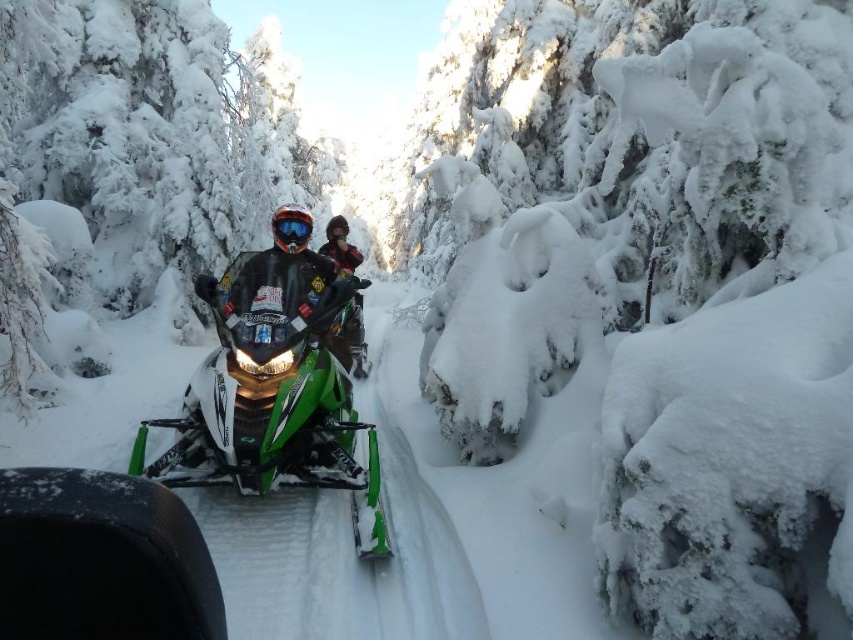
Based on the photo, does white frosty tree at center appear on the left side of green matte/snowmobile at center?

Yes, white frosty tree at center is to the left of green matte/snowmobile at center.

Which is below, white frosty tree at center or green matte/snowmobile at center?

green matte/snowmobile at center is below.

Identify the location of white frosty tree at center. (132, 150).

Is shiny black jacket at center to the left of red plaid jacket at center from the viewer's perspective?

In fact, shiny black jacket at center is to the right of red plaid jacket at center.

Can you confirm if shiny black jacket at center is wider than red plaid jacket at center?

In fact, shiny black jacket at center might be narrower than red plaid jacket at center.

Describe the element at coordinates (306, 288) in the screenshot. This screenshot has width=853, height=640. I see `shiny black jacket at center` at that location.

Find the location of a particular element. This screenshot has width=853, height=640. shiny black jacket at center is located at coordinates (306, 288).

Who is lower down, white frosty tree at center or shiny black jacket at center?

Positioned lower is shiny black jacket at center.

Is white frosty tree at center to the left of shiny black jacket at center from the viewer's perspective?

Correct, you'll find white frosty tree at center to the left of shiny black jacket at center.

Is point (173, 81) farther from viewer compared to point (271, 310)?

Yes, it is.

Identify the location of white frosty tree at center. The height and width of the screenshot is (640, 853). (132, 150).